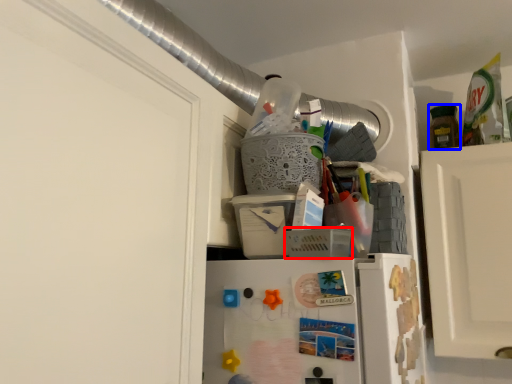
Question: Which point is closer to the camera, basket (highlighted by a red box) or bottle (highlighted by a blue box)?

Choices:
 (A) basket
 (B) bottle

Answer: (A)